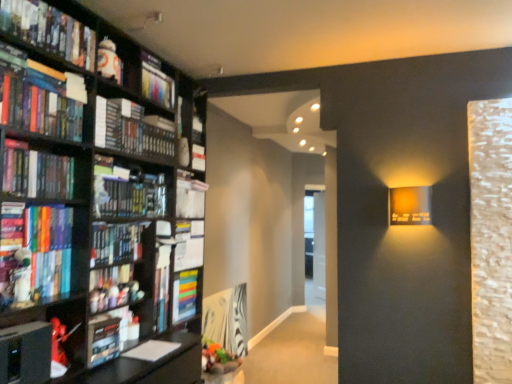
Question: Is white matte bookshelf at upper left, the 5th book when ordered from bottom to top, to the left or to the right of hardcover book at upper left, the ninth book positioned from the bottom, in the image?

Choices:
 (A) left
 (B) right

Answer: (B)

Question: From the image's perspective, relative to hardcover book at upper left, which ranks as the 1th book in top-to-bottom order, is white matte bookshelf at upper left, the fifth book when ordered from top to bottom, above or below?

Choices:
 (A) above
 (B) below

Answer: (B)

Question: Which object is positioned farthest from the matte black book at left, the third book from the top?

Choices:
 (A) hardcover book at upper left, which ranks as the 1th book in top-to-bottom order
 (B) hardcover book at lower left, acting as the 9th book starting from the top
 (C) hardcover book at left, the fourth book in the bottom-to-top sequence
 (D) matte plastic book at upper left, the 8th book when ordered from bottom to top
 (E) white matte bookshelf at upper left, the fifth book when ordered from top to bottom

Answer: (E)

Question: Which of these objects is positioned closest to the hardcover book at lower left, marked as the 1th book in a bottom-to-top arrangement?

Choices:
 (A) white matte bookshelf at upper left, the fifth book when ordered from top to bottom
 (B) hardcover book at upper left, the ninth book positioned from the bottom
 (C) white glossy figurine at upper left
 (D) hardcover book at left, the fourth book when ordered from top to bottom
 (E) matte plastic book at upper left, the 8th book when ordered from bottom to top

Answer: (D)